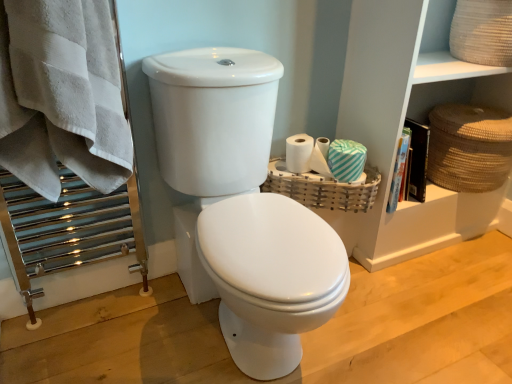
Image resolution: width=512 pixels, height=384 pixels. In order to click on blank space situated above woven wood basket at right, the second basket in the right-to-left sequence (from a real-world perspective) in this screenshot , I will do `click(320, 164)`.